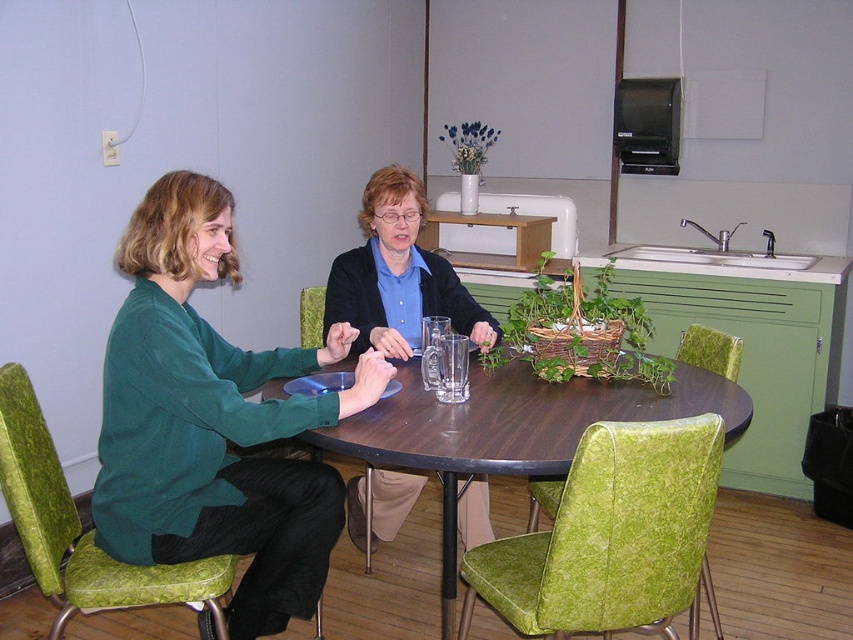
Can you confirm if wooden table at center is bigger than matte black sweater at center?

Yes.

Between wooden table at center and matte black sweater at center, which one appears on the right side from the viewer's perspective?

From the viewer's perspective, wooden table at center appears more on the right side.

Which is in front, point (529, 433) or point (396, 296)?

Point (529, 433) is in front.

Find the location of a particular element. wooden table at center is located at coordinates (512, 429).